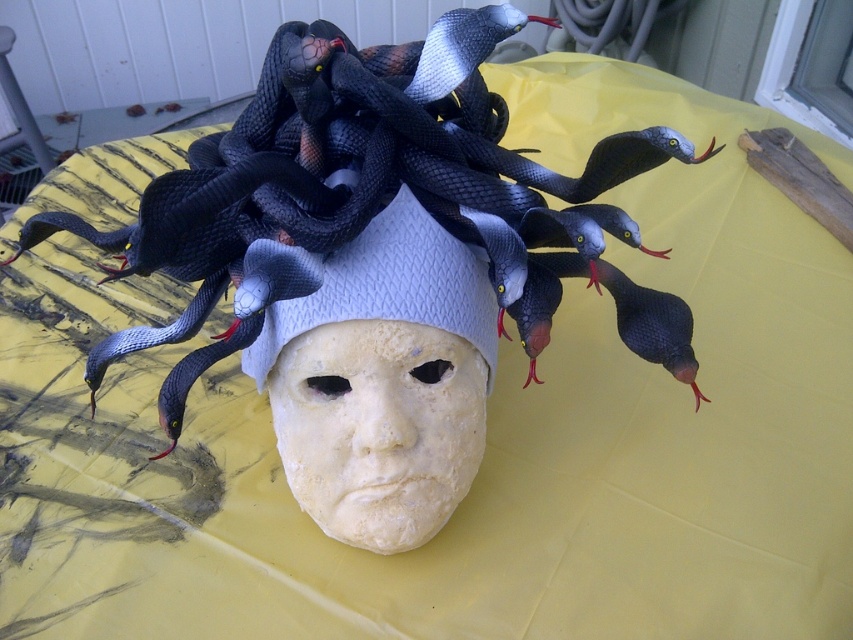
You are an art curator examining the Medusa sculpture. You need to determine if the black matte snakes at center can be seen above the white matte headdress at center. Based on the sculpture description, what is your conclusion?

The black matte snakes at center is taller than the white matte headdress at center, so yes, the snakes can be seen above the headdress.

You are an art conservator examining the Medusa sculpture. You need to determine if the black matte snakes at center will fit into a storage container designed for the white matte headdress at center. Based on their widths, will the snakes fit?

The black matte snakes at center are wider than the white matte headdress at center, so they will not fit into the storage container designed for the headdress.

Consider the image. You are an art conservator tasked with placing a protective glass dome over the sculpture. The dome has a diameter of 4 inches. Based on the distance between the black matte snakes at center and the white matte headdress at center, will the dome fit over both objects without touching either?

The black matte snakes at center is 3.84 inches from the white matte headdress at center. Since the dome has a diameter of 4 inches, which is slightly larger than the distance between them, the dome can fit over both objects without touching either.